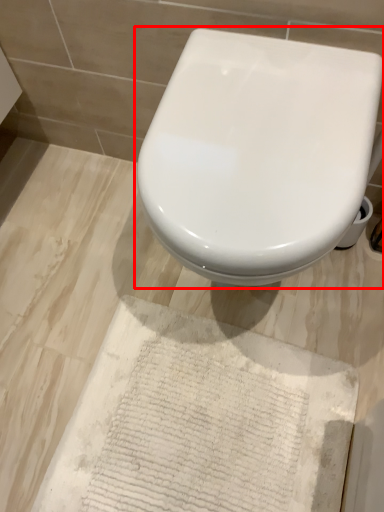
Question: From the image's perspective, what is the correct spatial positioning of toilet (annotated by the red box) in reference to parchment?

Choices:
 (A) above
 (B) below

Answer: (A)